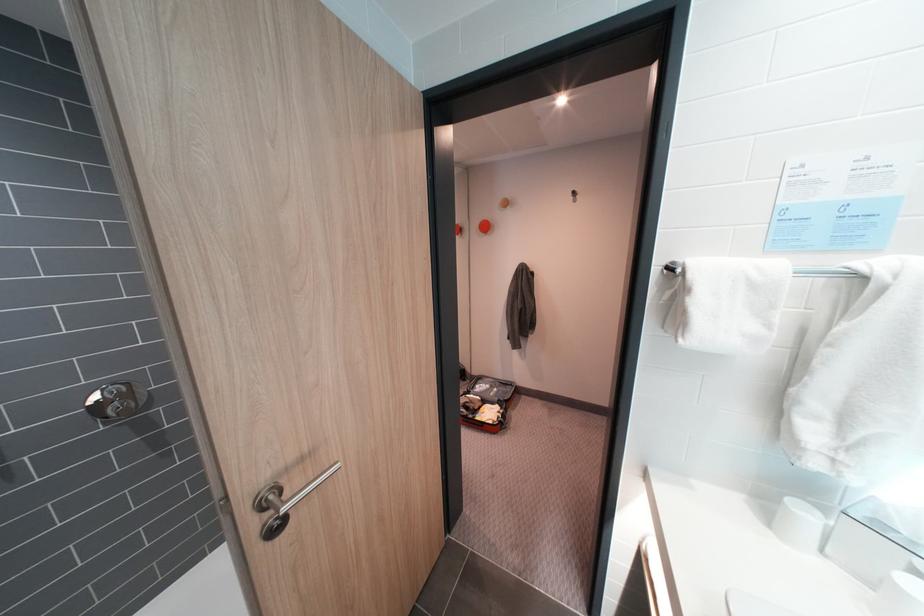
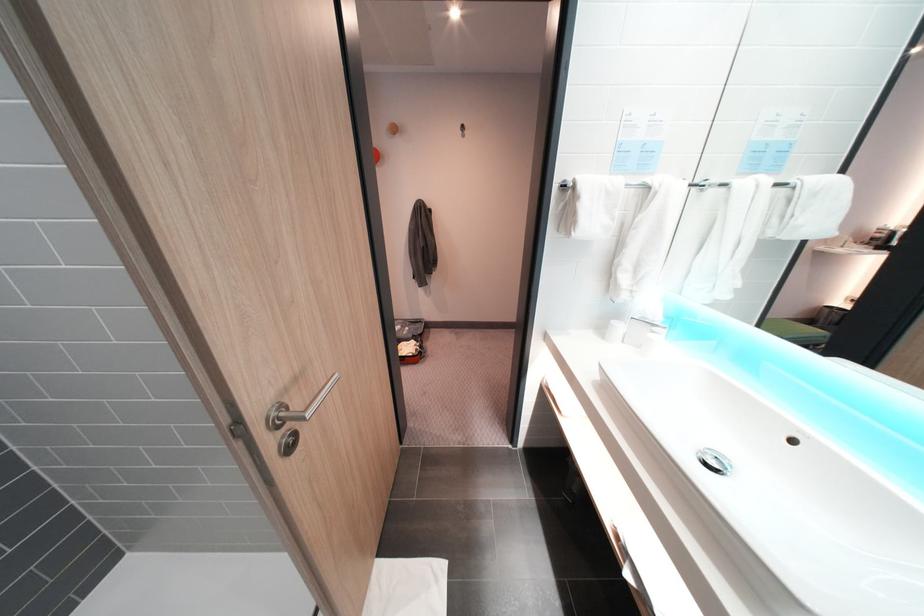
Where in the second image is the point corresponding to [283,498] from the first image?

(294, 415)